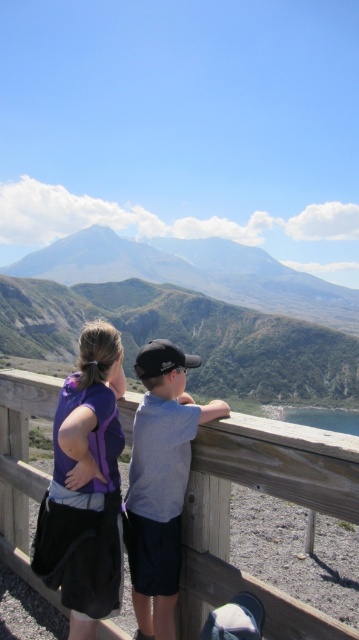
You are a photographer wanting to capture a photo of the two people in the scene. You need to ensure that both the purple fabric shirt at left and the gray cotton shirt at upper center are visible in the frame. Based on their positions, which shirt should you focus on first to ensure both are in the shot?

Since the purple fabric shirt at left is positioned to the left of the gray cotton shirt at upper center, you should focus on the gray cotton shirt at upper center first to ensure both are within the frame.

You are standing at the point labeled as point (264, 400) and want to take a photo of the mountain range in the background. The camera you are using has a focal length of 50mm. To ensure the entire mountain range fits in the frame, what is the minimum distance you should maintain between yourself and the camera?

The minimum distance you should maintain between yourself and the camera is 136.59 meters to ensure the entire mountain range fits in the frame.

You are a photographer trying to capture a group photo of the two people wearing the purple fabric shirt at left and the gray cotton shirt at upper center. The minimum distance required between subjects for your camera to focus properly is 3 feet. Can you take the photo without moving either person?

The purple fabric shirt at left and the gray cotton shirt at upper center are 3.36 feet apart, which exceeds the minimum 3 feet requirement. Therefore, the photographer can take the photo without moving either person.